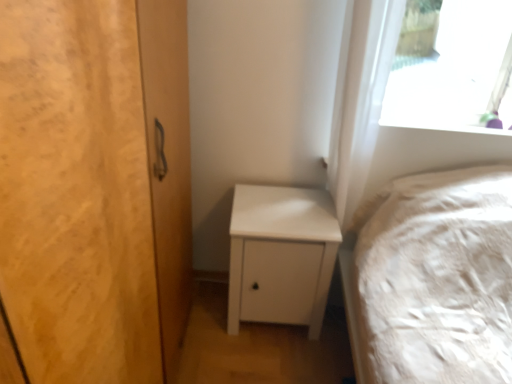
The image size is (512, 384). Identify the location of vacant space positioned to the left of white matte nightstand at lower center. (203, 322).